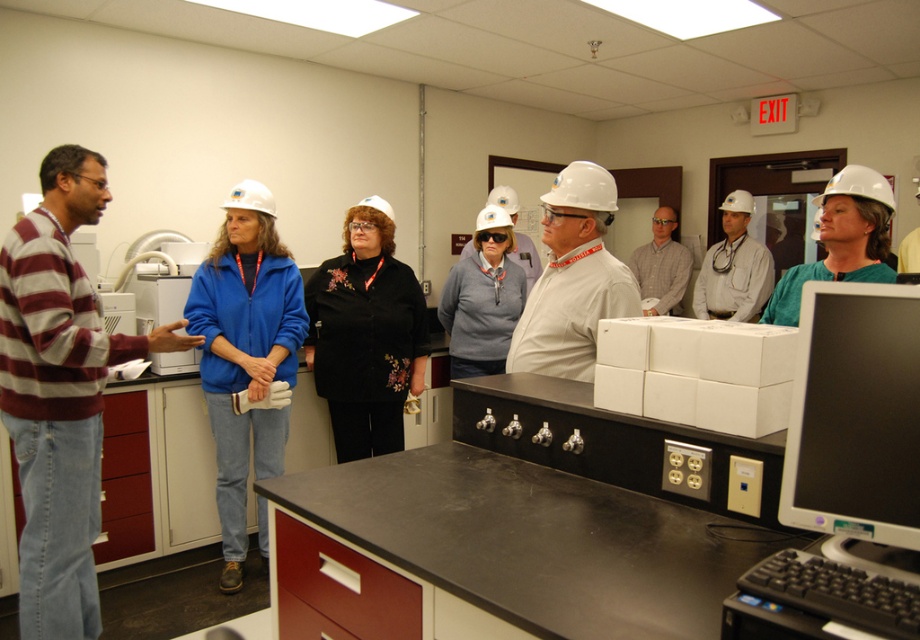
Between gray fleece jacket at center and green matte hard hat at upper right, which one is positioned lower?

gray fleece jacket at center is below.

Is gray fleece jacket at center to the left of green matte hard hat at upper right from the viewer's perspective?

Indeed, gray fleece jacket at center is positioned on the left side of green matte hard hat at upper right.

Describe the element at coordinates (483, 298) in the screenshot. This screenshot has height=640, width=920. I see `gray fleece jacket at center` at that location.

In order to click on gray fleece jacket at center in this screenshot , I will do `click(483, 298)`.

Can you confirm if striped sweater at left is positioned above blue fabric jacket at center?

Yes.

Does striped sweater at left appear on the right side of blue fabric jacket at center?

In fact, striped sweater at left is to the left of blue fabric jacket at center.

Who is more forward, (x=59, y=636) or (x=228, y=522)?

Point (x=59, y=636) is more forward.

The image size is (920, 640). What are the coordinates of `striped sweater at left` in the screenshot? It's located at (59, 394).

Consider the image. Does black velvet jacket at center have a lesser height compared to gray fleece jacket at center?

Incorrect, black velvet jacket at center's height does not fall short of gray fleece jacket at center's.

The height and width of the screenshot is (640, 920). What do you see at coordinates (366, 333) in the screenshot?
I see `black velvet jacket at center` at bounding box center [366, 333].

This screenshot has width=920, height=640. What are the coordinates of `black velvet jacket at center` in the screenshot? It's located at (366, 333).